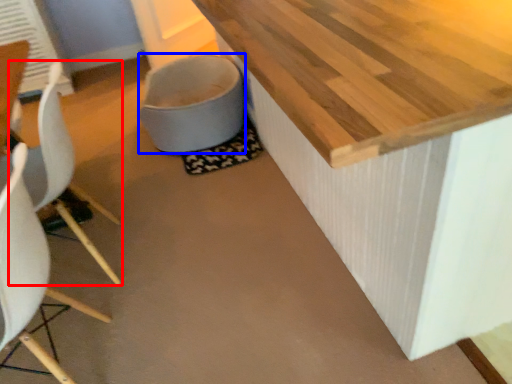
Question: Among these objects, which one is nearest to the camera, chair (highlighted by a red box) or toilet bowl (highlighted by a blue box)?

Choices:
 (A) chair
 (B) toilet bowl

Answer: (A)